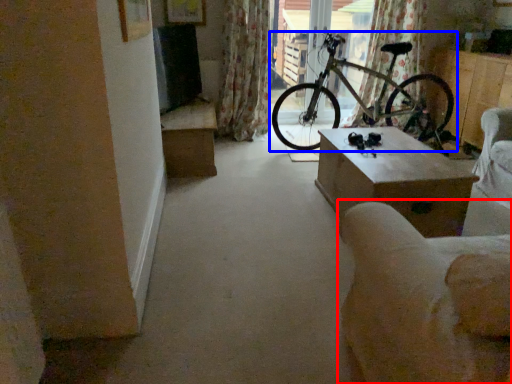
Question: Which object is further to the camera taking this photo, armchair (highlighted by a red box) or bicycle (highlighted by a blue box)?

Choices:
 (A) armchair
 (B) bicycle

Answer: (B)